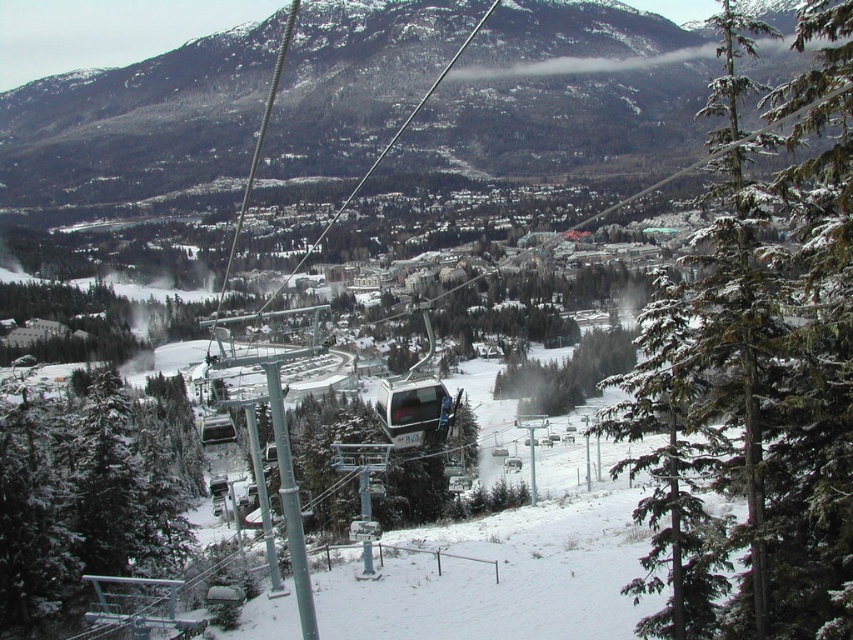
You are a skier looking at the mountain landscape from a ski lift. You notice a point marked at coordinates [756,378]. Based on the scene, what object is located at that point?

The point at coordinates [756,378] indicates a green textured pine tree at center right.

You are a skier trying to navigate between the green textured pine tree at center right and the metallic silver cable car at center. How far apart are these two landmarks?

The green textured pine tree at center right and the metallic silver cable car at center are 35.03 meters apart from each other.